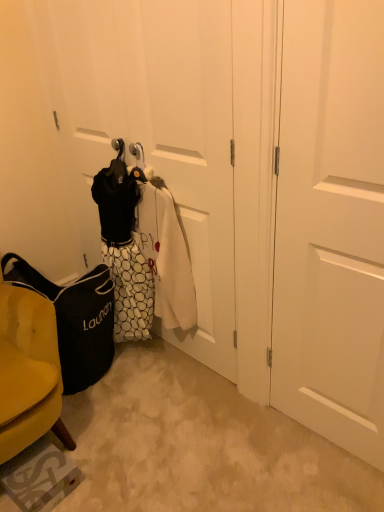
Question: Can you confirm if black fabric laundry bag at lower left is wider than white matte door at center right?

Choices:
 (A) yes
 (B) no

Answer: (A)

Question: Is black fabric laundry bag at lower left to the right of white matte door at center right from the viewer's perspective?

Choices:
 (A) no
 (B) yes

Answer: (A)

Question: Does black fabric laundry bag at lower left have a greater height compared to white matte door at center right?

Choices:
 (A) yes
 (B) no

Answer: (B)

Question: Does black fabric laundry bag at lower left have a lesser height compared to white matte door at center right?

Choices:
 (A) yes
 (B) no

Answer: (A)

Question: From a real-world perspective, is black fabric laundry bag at lower left located beneath white matte door at center right?

Choices:
 (A) no
 (B) yes

Answer: (B)

Question: Considering the relative sizes of black fabric laundry bag at lower left and white matte door at center right in the image provided, is black fabric laundry bag at lower left bigger than white matte door at center right?

Choices:
 (A) yes
 (B) no

Answer: (A)

Question: From the image's perspective, is white matte door at center right above black fabric laundry bag at lower left?

Choices:
 (A) yes
 (B) no

Answer: (A)

Question: Is black fabric laundry bag at lower left a part of white matte door at center right?

Choices:
 (A) no
 (B) yes

Answer: (A)

Question: Does white matte door at center right have a larger size compared to black fabric laundry bag at lower left?

Choices:
 (A) no
 (B) yes

Answer: (A)

Question: Considering the relative sizes of white matte door at center right and black fabric laundry bag at lower left in the image provided, is white matte door at center right shorter than black fabric laundry bag at lower left?

Choices:
 (A) no
 (B) yes

Answer: (A)

Question: From the image's perspective, would you say white matte door at center right is shown under black fabric laundry bag at lower left?

Choices:
 (A) no
 (B) yes

Answer: (A)

Question: Does white matte door at center right appear on the right side of black fabric laundry bag at lower left?

Choices:
 (A) no
 (B) yes

Answer: (B)

Question: Is black fabric laundry bag at lower left further to camera compared to white dotted fabric laundry at center?

Choices:
 (A) no
 (B) yes

Answer: (B)